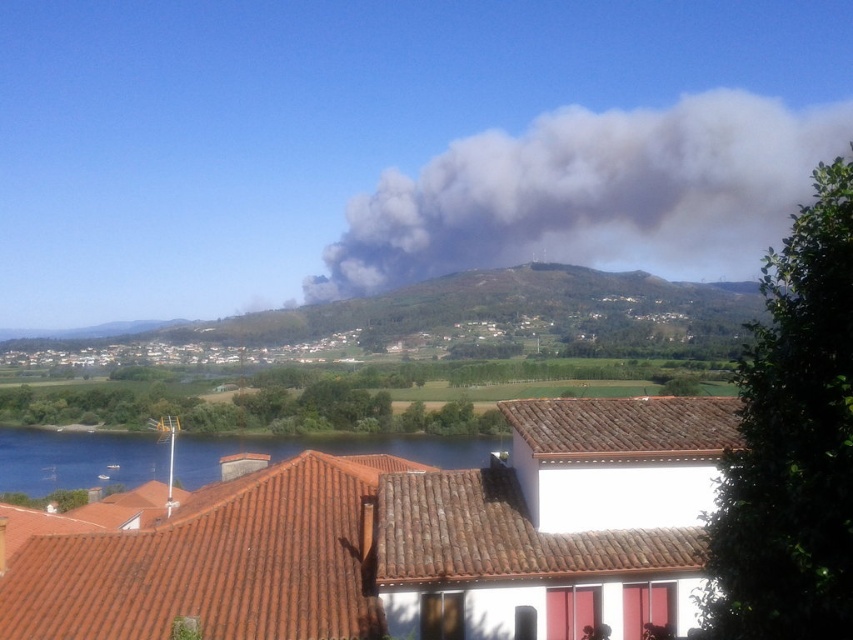
Who is shorter, gray smoke at upper center or blue water at lower left?

With less height is blue water at lower left.

What do you see at coordinates (593, 195) in the screenshot?
I see `gray smoke at upper center` at bounding box center [593, 195].

You are a GUI agent. You are given a task and a screenshot of the screen. Output one action in this format:
    pyautogui.click(x=<x>, y=<y>)
    Task: Click on the gray smoke at upper center
    This screenshot has height=640, width=853.
    Given the screenshot: What is the action you would take?
    pyautogui.click(x=593, y=195)